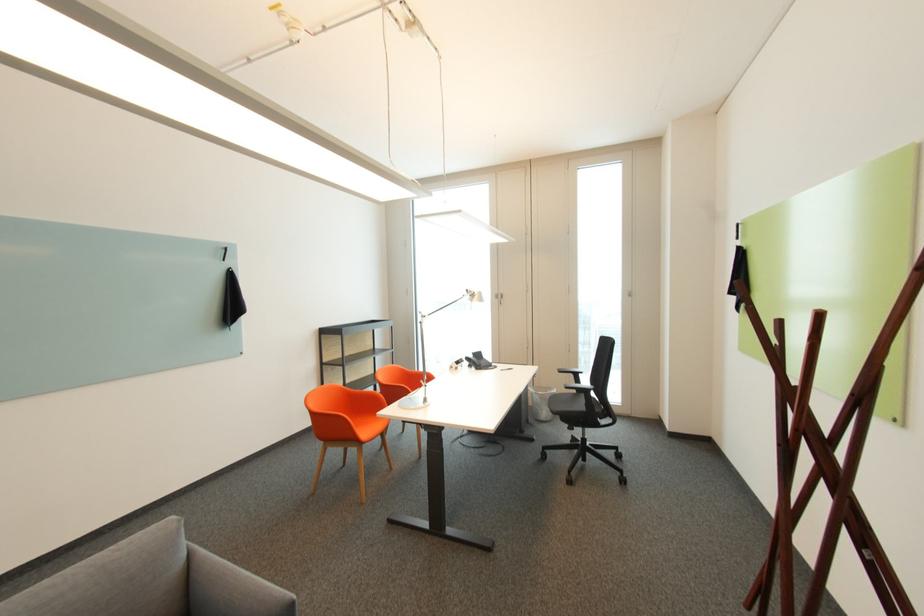
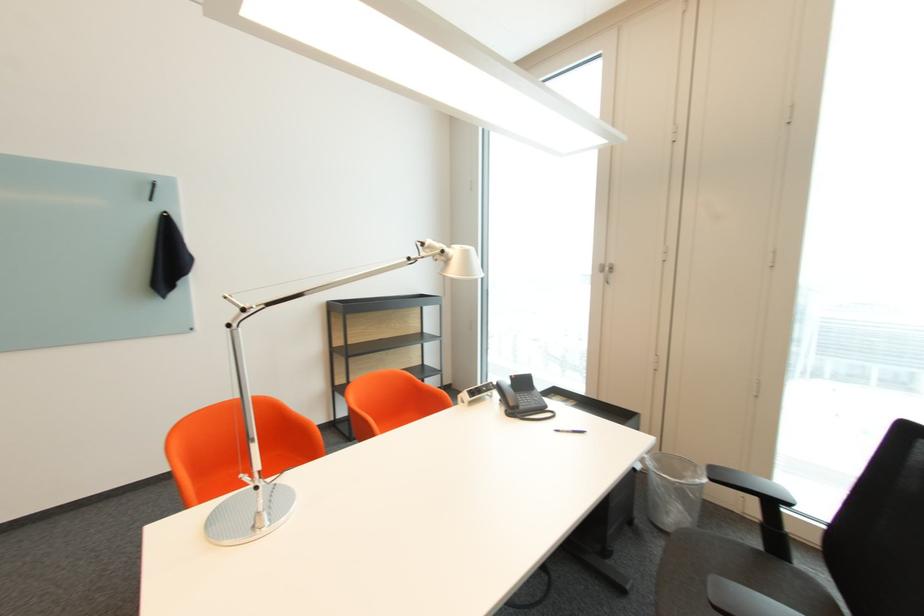
Question: Which direction would the cameraman need to move to produce the second image? Reply with the corresponding letter.

Choices:
 (A) Left
 (B) Right
 (C) Forward
 (D) Backward

Answer: (C)